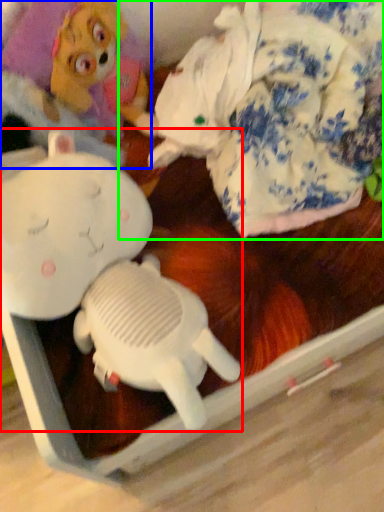
Question: Estimate the real-world distances between objects in this image. Which object is farther from toy (highlighted by a red box), toy (highlighted by a blue box) or toy (highlighted by a green box)?

Choices:
 (A) toy
 (B) toy

Answer: (B)